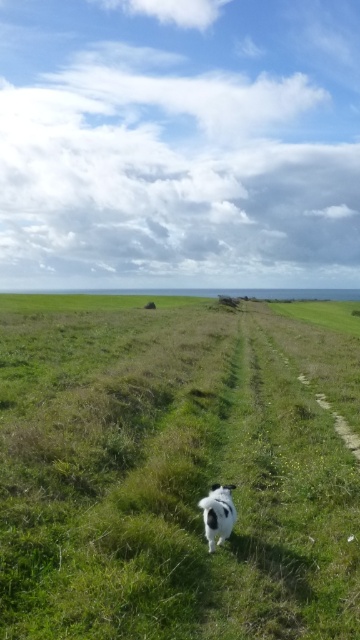
You are a photographer trying to capture the black and white fur dog at center in the image. Since the green grassy at center is also present, will the dog be easily visible against the grass?

The green grassy at center is larger in size than the black and white fur dog at center, so the dog will be easily visible as it is smaller and contrasts well against the larger grassy area.

You are a photographer trying to capture the black and white fur dog at center in the image. To ensure the dog stands out against the green grassy at center, which part of the scene should you focus on, and why?

The green grassy at center has a greater height compared to the black and white fur dog at center. To make the dog stand out, focus on the dog since it is lower than the grass, creating a contrast in height that can help it visually pop against the background.